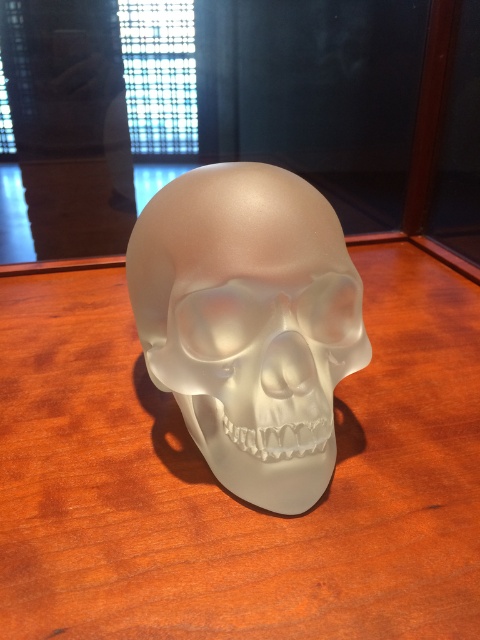
Question: Is satin wood table at center further to camera compared to satin white skull at center?

Choices:
 (A) yes
 (B) no

Answer: (B)

Question: Is satin wood table at center below satin white skull at center?

Choices:
 (A) yes
 (B) no

Answer: (A)

Question: Which point is closer to the camera taking this photo?

Choices:
 (A) (200, 369)
 (B) (459, 320)

Answer: (A)

Question: Which object is farther from the camera taking this photo?

Choices:
 (A) satin wood table at center
 (B) satin white skull at center

Answer: (B)

Question: Is satin wood table at center bigger than satin white skull at center?

Choices:
 (A) yes
 (B) no

Answer: (A)